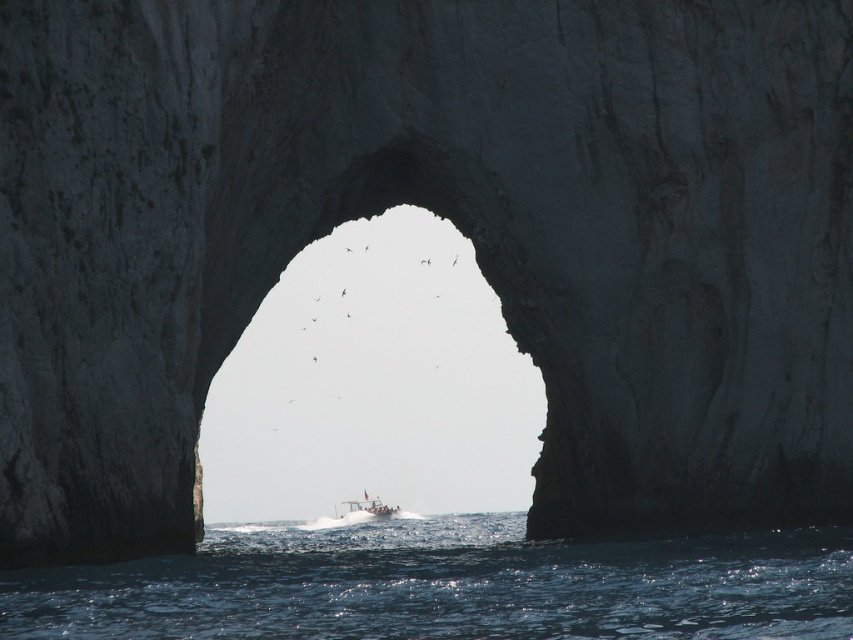
Is blue liquid water at lower center positioned behind white plastic boat at center?

No.

Describe the element at coordinates (445, 586) in the screenshot. This screenshot has width=853, height=640. I see `blue liquid water at lower center` at that location.

You are a GUI agent. You are given a task and a screenshot of the screen. Output one action in this format:
    pyautogui.click(x=<x>, y=<y>)
    Task: Click on the blue liquid water at lower center
    This screenshot has height=640, width=853.
    Given the screenshot: What is the action you would take?
    pyautogui.click(x=445, y=586)